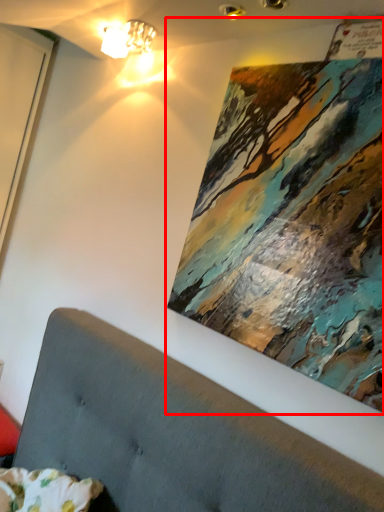
Question: From the image's perspective, what is the correct spatial positioning of picture frame (annotated by the red box) in reference to lamp?

Choices:
 (A) above
 (B) below

Answer: (B)